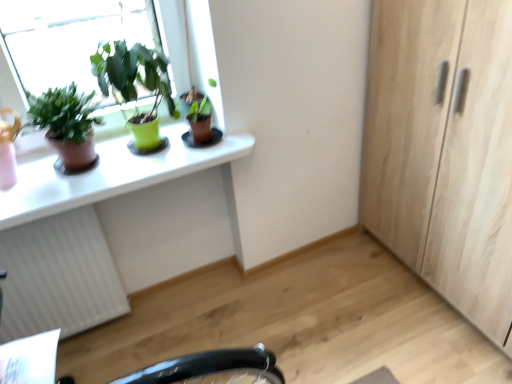
At what (x,y) coordinates should I click in order to perform the action: click on free space that is in between matte brown pot at upper left, arranged as the 3th houseplant when viewed from the right, and green matte pot at upper left, which is counted as the 2th houseplant, starting from the left. Please return your answer as a coordinate pair (x, y). The width and height of the screenshot is (512, 384). Looking at the image, I should click on (142, 161).